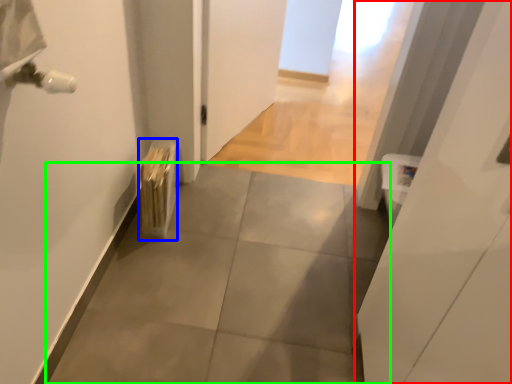
Question: Which object is the farthest from door (highlighted by a red box)? Choose among these: radiator (highlighted by a blue box) or concrete (highlighted by a green box).

Choices:
 (A) radiator
 (B) concrete

Answer: (A)